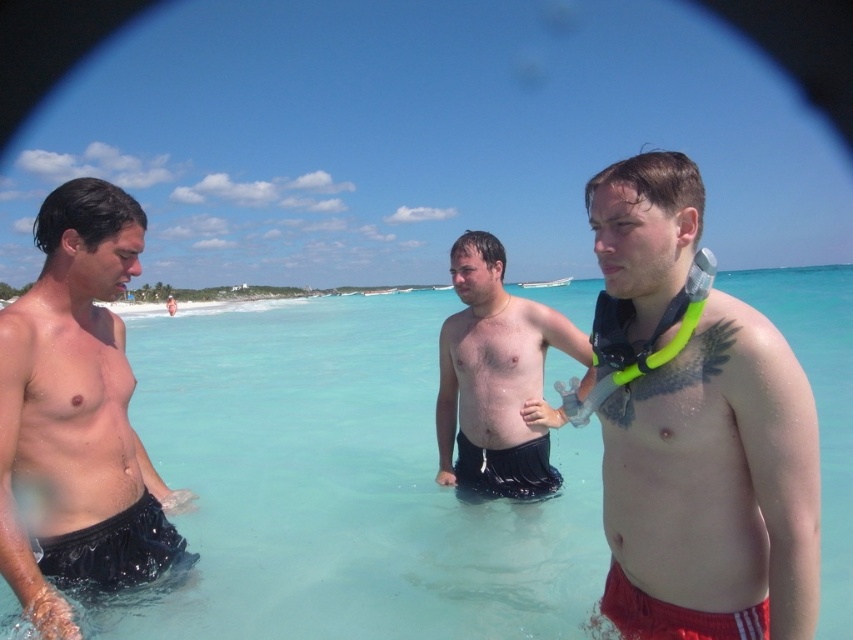
Is shiny black shorts at left above red fabric shorts at lower right?

Yes.

Who is shorter, shiny black shorts at left or red fabric shorts at lower right?

red fabric shorts at lower right

Does point (126, 509) lie in front of point (698, 611)?

No, it is behind (698, 611).

Identify the location of shiny black shorts at left. (76, 417).

The image size is (853, 640). In order to click on shiny black shorts at left in this screenshot , I will do `click(76, 417)`.

Is shiny black shorts at left closer to the viewer compared to black mesh shorts at lower left?

Yes, it is.

Is point (57, 292) less distant than point (96, 586)?

No.

Where is `shiny black shorts at left`? The height and width of the screenshot is (640, 853). shiny black shorts at left is located at coordinates (76, 417).

Who is higher up, clear blue water at center or smooth black shorts at center?

Positioned higher is clear blue water at center.

I want to click on clear blue water at center, so click(x=341, y=484).

The height and width of the screenshot is (640, 853). What do you see at coordinates (341, 484) in the screenshot?
I see `clear blue water at center` at bounding box center [341, 484].

Find the location of `clear blue water at center`. clear blue water at center is located at coordinates (341, 484).